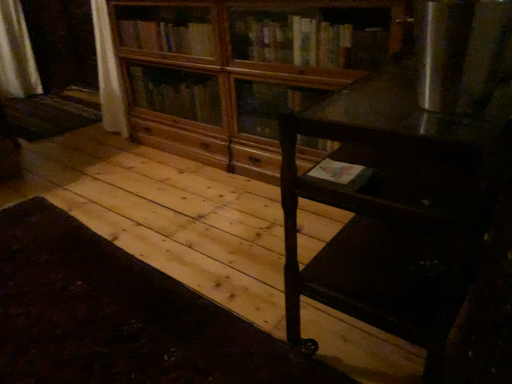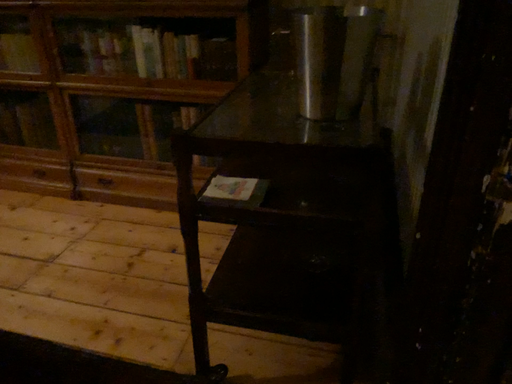
Question: How did the camera likely rotate when shooting the video?

Choices:
 (A) rotated right
 (B) rotated left

Answer: (A)